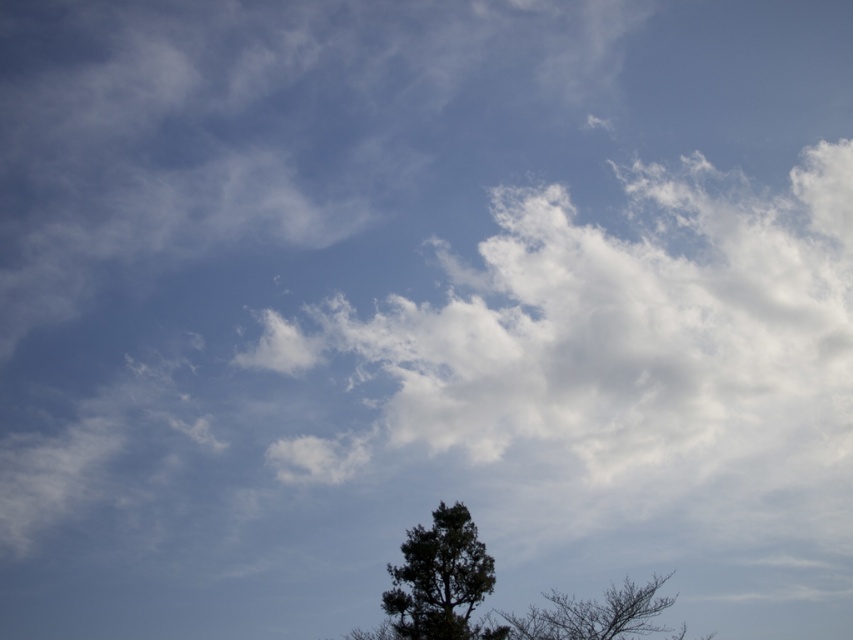
Question: Does dark green textured tree at lower center appear on the right side of silhouette bark tree at lower right?

Choices:
 (A) yes
 (B) no

Answer: (B)

Question: Which point is closer to the camera taking this photo?

Choices:
 (A) (625, 614)
 (B) (421, 636)

Answer: (B)

Question: Does dark green textured tree at lower center appear under silhouette bark tree at lower right?

Choices:
 (A) no
 (B) yes

Answer: (B)

Question: Is dark green textured tree at lower center above silhouette bark tree at lower right?

Choices:
 (A) yes
 (B) no

Answer: (B)

Question: Among these objects, which one is nearest to the camera?

Choices:
 (A) dark green textured tree at lower center
 (B) silhouette bark tree at lower right

Answer: (B)